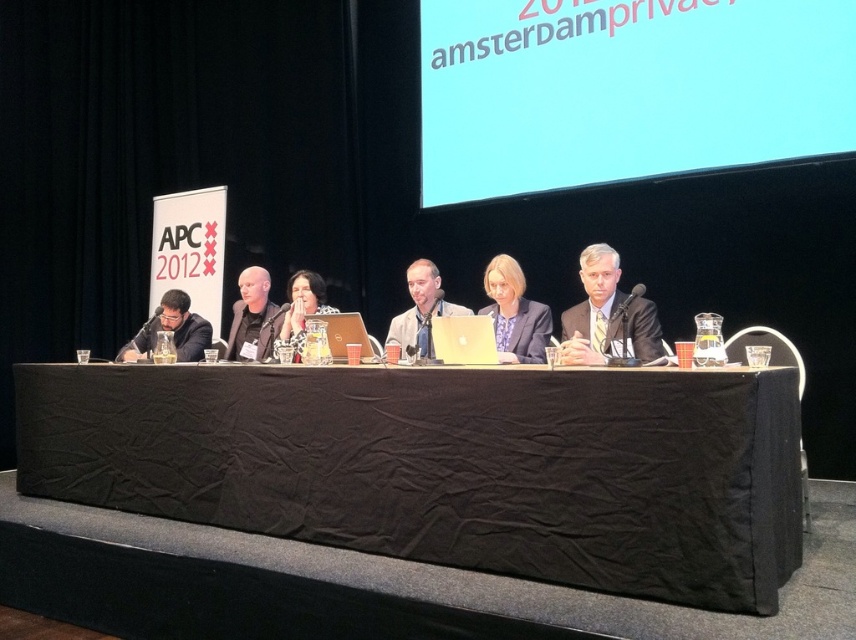
Question: Which point is closer to the camera?

Choices:
 (A) matte silver laptop at center
 (B) black fabric table at center
 (C) metallic silver laptop at center
 (D) matte black shirt at center

Answer: (B)

Question: Which of the following is the farthest from the observer?

Choices:
 (A) matte black laptop at left
 (B) matte gray suit at center
 (C) white glossy screen at upper center

Answer: (C)

Question: Observing the image, what is the correct spatial positioning of white glossy screen at upper center in reference to metallic silver laptop at center?

Choices:
 (A) left
 (B) right

Answer: (B)

Question: Can you confirm if silver metallic laptop at center is positioned below metallic silver laptop at center?

Choices:
 (A) no
 (B) yes

Answer: (B)

Question: Which point is closer to the camera?

Choices:
 (A) (453, 26)
 (B) (414, 305)
 (C) (509, 352)

Answer: (C)

Question: Where is matte black suit at center located in relation to matte black laptop at center in the image?

Choices:
 (A) below
 (B) above

Answer: (B)